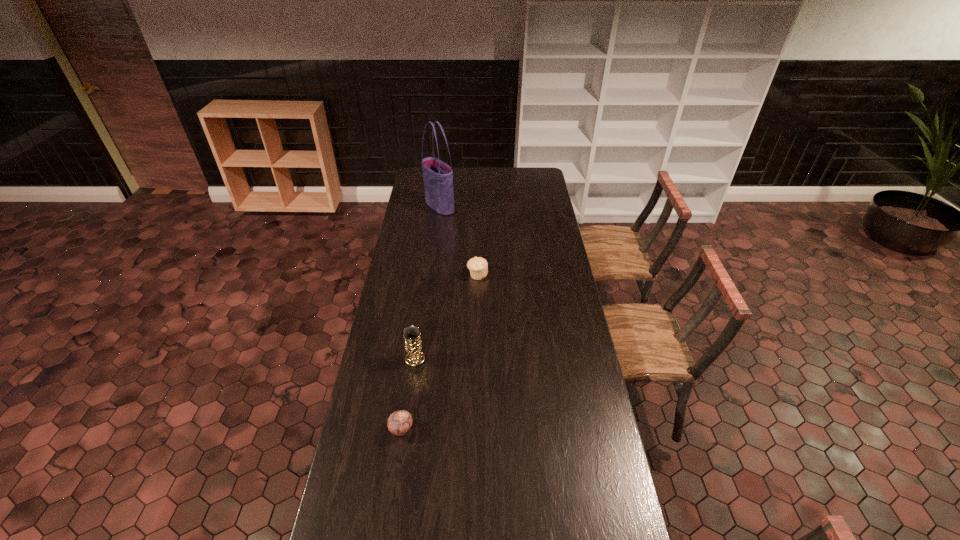
The image size is (960, 540). I want to click on vacant region between the chalice and the farthest object, so click(x=427, y=282).

Where is `free spot between the shorter muffin and the second shortest object`? The image size is (960, 540). free spot between the shorter muffin and the second shortest object is located at coordinates (440, 352).

Identify the location of free space between the farthest object and the farther muffin. (459, 241).

Find the location of a particular element. This screenshot has width=960, height=540. free space that is in between the tote bag and the farther muffin is located at coordinates (459, 241).

Where is `vacant space that's between the shortest object and the second tallest object`? This screenshot has height=540, width=960. vacant space that's between the shortest object and the second tallest object is located at coordinates (408, 394).

Where is `free spot between the third farthest object and the left muffin`? free spot between the third farthest object and the left muffin is located at coordinates (408, 394).

The image size is (960, 540). I want to click on vacant area that lies between the tote bag and the chalice, so click(427, 282).

Where is `vacant space in between the second farthest object and the third farthest object`? The width and height of the screenshot is (960, 540). vacant space in between the second farthest object and the third farthest object is located at coordinates (446, 317).

Select which object is the third closest to the third nearest object. Please provide its 2D coordinates. Your answer should be formatted as a tuple, i.e. [(x, y)], where the tuple contains the x and y coordinates of a point satisfying the conditions above.

[(399, 422)]

You are a GUI agent. You are given a task and a screenshot of the screen. Output one action in this format:
    pyautogui.click(x=<x>, y=<y>)
    Task: Click on the object that is the closest one to the tallest object
    
    Given the screenshot: What is the action you would take?
    pyautogui.click(x=478, y=266)